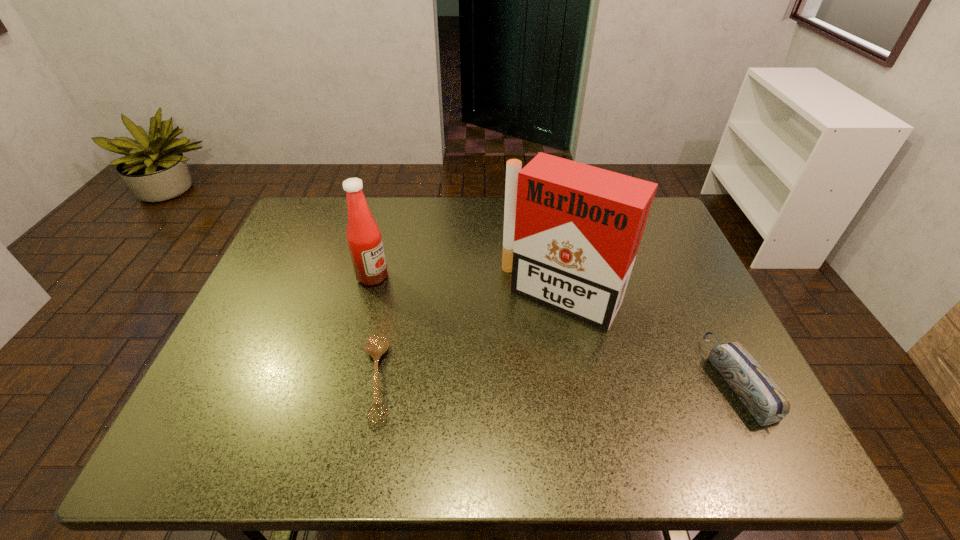
This screenshot has width=960, height=540. I want to click on vacant space situated 0.270m on the front-facing side of the cigarette case, so click(477, 411).

The width and height of the screenshot is (960, 540). I want to click on free region located on the front-facing side of the second tallest object, so click(x=475, y=332).

The image size is (960, 540). I want to click on blank area located on the front-facing side of the second tallest object, so coord(496,343).

The height and width of the screenshot is (540, 960). Find the location of `vacant space located on the front-facing side of the second tallest object`. vacant space located on the front-facing side of the second tallest object is located at coordinates (430, 307).

Locate an element on the screen. This screenshot has width=960, height=540. ladle situated at the near edge is located at coordinates (377, 344).

Identify the location of pencil box that is at the near edge. (766, 402).

Image resolution: width=960 pixels, height=540 pixels. Find the location of `object that is at the right edge`. object that is at the right edge is located at coordinates (766, 402).

Image resolution: width=960 pixels, height=540 pixels. Find the location of `object present at the near right corner`. object present at the near right corner is located at coordinates (766, 402).

The width and height of the screenshot is (960, 540). I want to click on free space at the far edge of the desktop, so click(424, 205).

Find the location of a particular element. The width and height of the screenshot is (960, 540). free space at the near edge of the desktop is located at coordinates (408, 390).